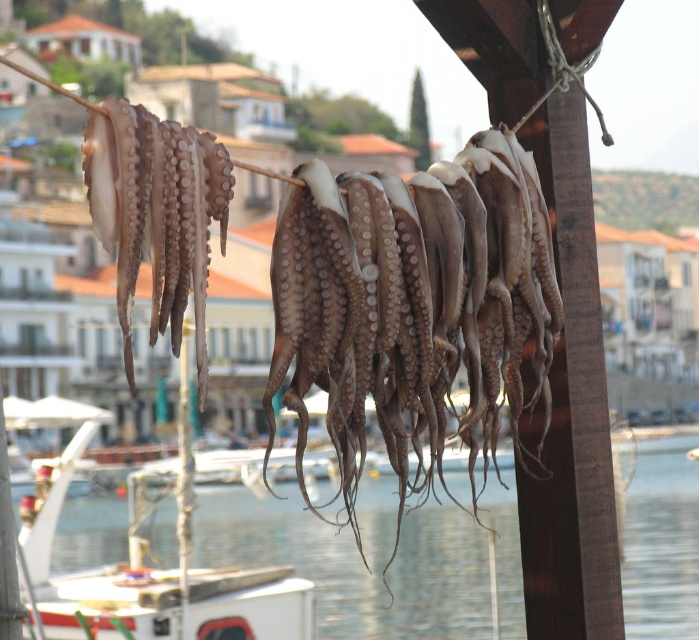
You are an observer standing at the center of the image. There is a point labeled as point (415, 307). What object is located at that point?

The brown matte squid at center is located at point (415, 307).

In the scene shown: You are an observer standing in front of the drying tentacles. You notice the translucent water at lower center and the brown matte squid at left. Which object occupies a wider area in the scene?

The translucent water at lower center occupies a wider area than the brown matte squid at left because its width is larger.